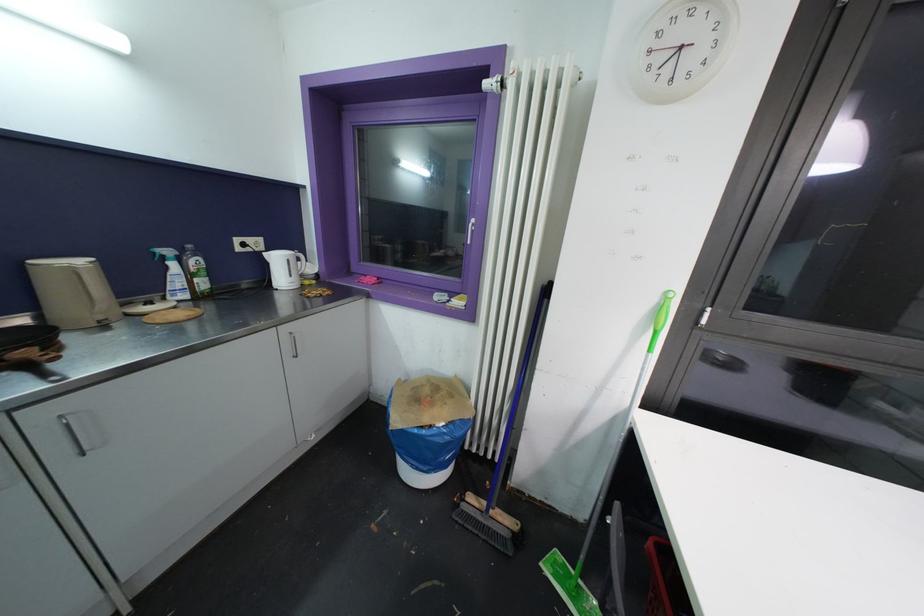
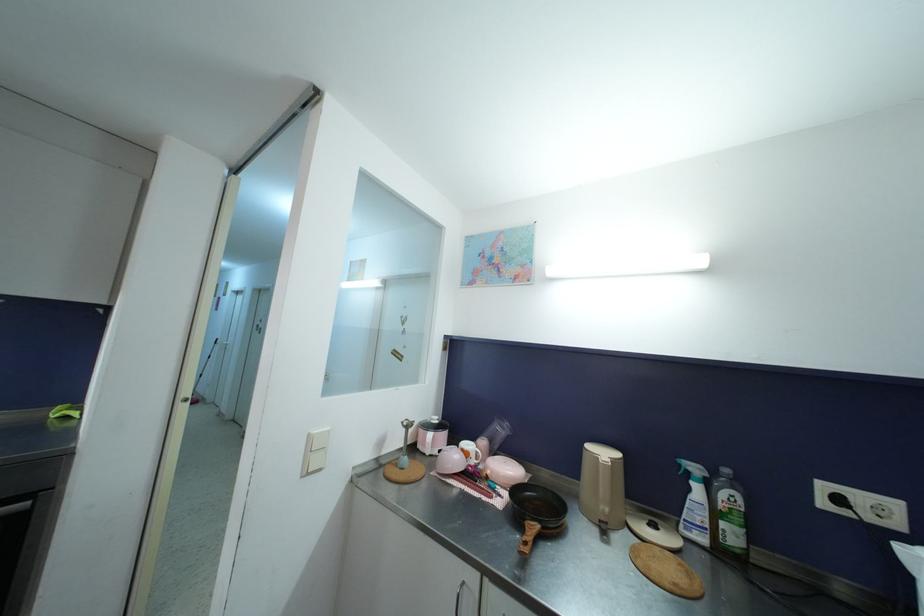
The point at (241, 252) is marked in the first image. Where is the corresponding point in the second image?

(827, 507)